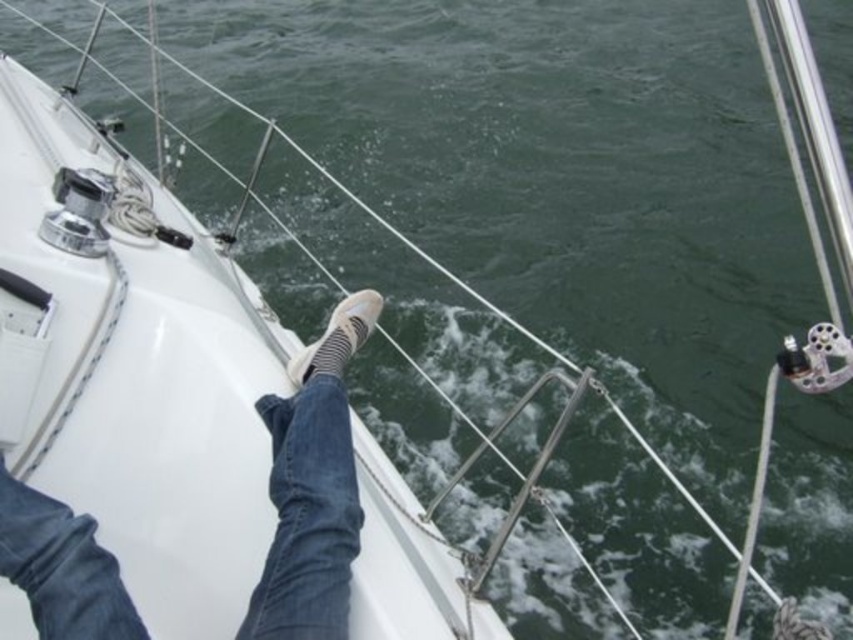
You are on a white sailboat and want to place a small buoy between the two points marked as point (282,440) and point (300,355). Which point should the buoy be closer to if it needs to be placed in the water closer to the boat?

The buoy should be placed closer to point (282,440) because it is closer to the camera, which is positioned on the boat, making that point nearer to the boat itself.

You are standing on the deck of the white sailboat and want to reach a point marked at coordinates point [341,394]. If your arm can extend 6 feet, can you comfortably reach that point without moving your position?

The point [341,394] is 6.94 feet away from the viewer. Since your arm can only extend 6 feet, you cannot comfortably reach it without moving your position.